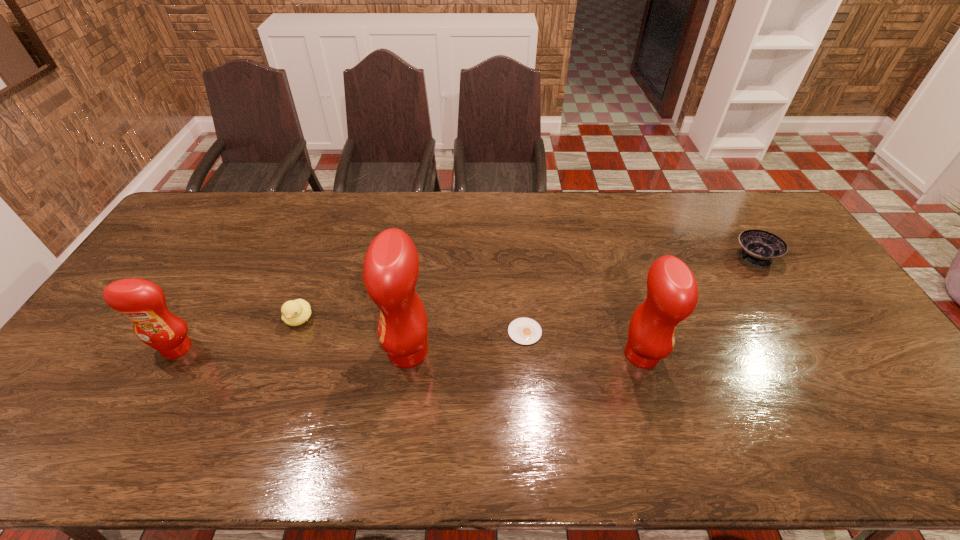
Locate an element on the screen. This screenshot has height=540, width=960. the third object from right to left is located at coordinates (526, 331).

The image size is (960, 540). Identify the location of vacant point located on the label side of the fourth shortest object. (139, 415).

The image size is (960, 540). What are the coordinates of `vacant space situated on the label side of the third object from left to right` in the screenshot? It's located at (247, 352).

At what (x,y) coordinates should I click in order to perform the action: click on blank space located on the label side of the third object from left to right. Please return your answer as a coordinate pair (x, y). Image resolution: width=960 pixels, height=540 pixels. Looking at the image, I should click on (274, 352).

What are the coordinates of `vacant area situated on the label side of the third object from left to right` in the screenshot? It's located at (266, 352).

Find the location of a particular element. Image resolution: width=960 pixels, height=540 pixels. free spot located 0.260m on the label side of the second tallest condiment is located at coordinates (758, 355).

This screenshot has height=540, width=960. I want to click on vacant space positioned 0.050m on the back of the rightmost object, so click(739, 234).

Identify the location of vacant space located at the beak of the second object from left to right. (265, 412).

Identify the location of vacant space located on the back of the shortest object. (518, 259).

This screenshot has height=540, width=960. I want to click on object situated at the right edge, so click(x=759, y=248).